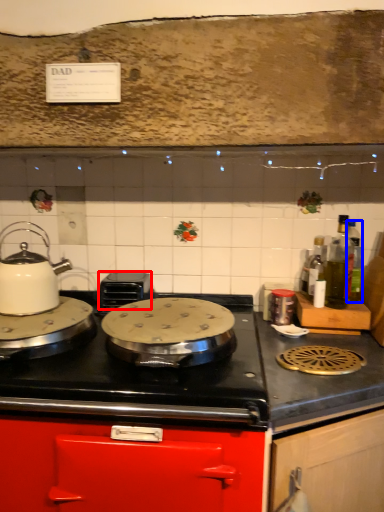
Question: Which object is closer to the camera taking this photo, appliance (highlighted by a red box) or bottle (highlighted by a blue box)?

Choices:
 (A) appliance
 (B) bottle

Answer: (B)